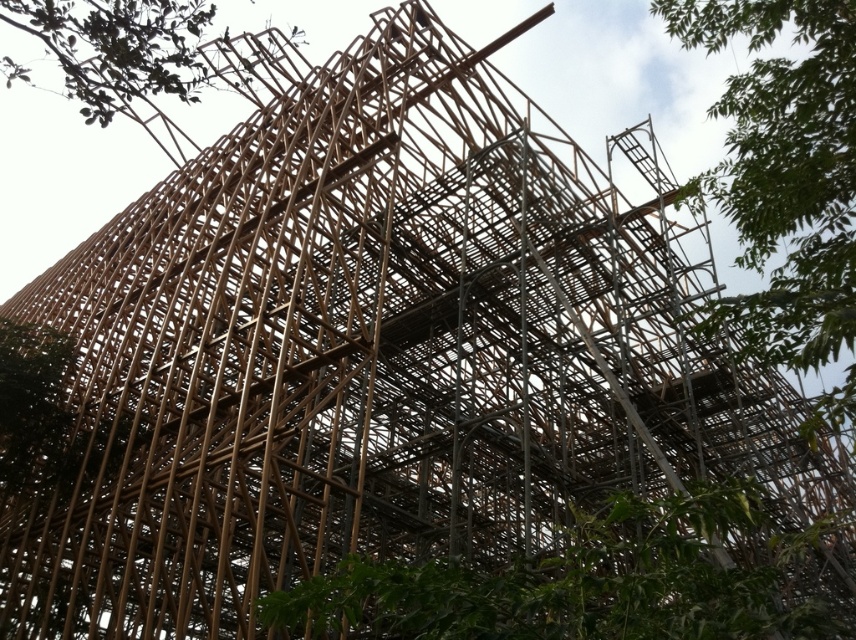
You are standing at the origin point of the image. Which direction should you move to reach the green leafy tree at lower center?

The green leafy tree at lower center is located at point (581, 582), so you should move towards the lower center direction to reach it.

You are a construction worker standing at the base of the bamboo scaffolding structure. You notice two points marked on the scaffolding structure at coordinates point (700,636) and point (818,10). Which point is closer to you as you face the structure?

Point (700,636) is in front of point (818,10), so it is closer to you as you face the structure.